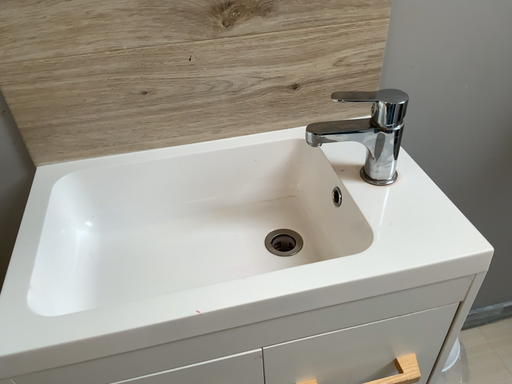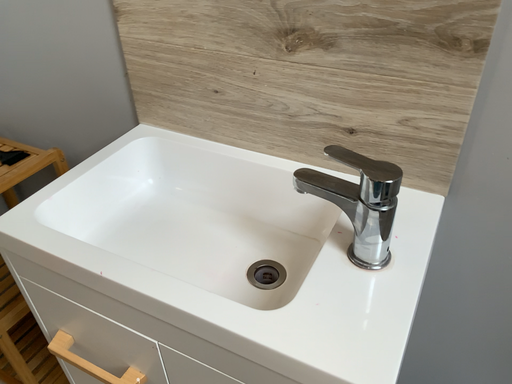
Question: Which way did the camera rotate in the video?

Choices:
 (A) rotated right
 (B) rotated left

Answer: (B)